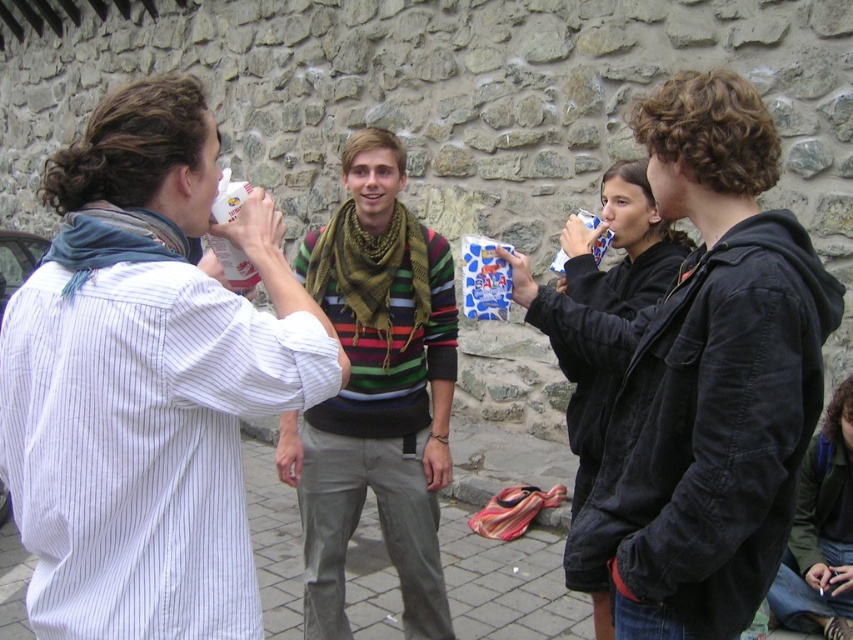
Between dark gray hoodie at right and white paper cup at upper left, which one appears on the right side from the viewer's perspective?

From the viewer's perspective, dark gray hoodie at right appears more on the right side.

Who is taller, dark gray hoodie at right or white paper cup at upper left?

dark gray hoodie at right is taller.

In order to click on dark gray hoodie at right in this screenshot , I will do `click(711, 380)`.

Can you confirm if white striped shirt at left is thinner than dark gray hoodie at right?

No, white striped shirt at left is not thinner than dark gray hoodie at right.

Which is in front, point (149, 148) or point (740, 371)?

Point (149, 148) is more forward.

This screenshot has height=640, width=853. Identify the location of white striped shirt at left. (148, 380).

Which is behind, point (149, 264) or point (811, 630)?

The point (811, 630) is behind.

Can you confirm if white striped shirt at left is thinner than dark green fabric jacket at lower right?

In fact, white striped shirt at left might be wider than dark green fabric jacket at lower right.

You are a GUI agent. You are given a task and a screenshot of the screen. Output one action in this format:
    pyautogui.click(x=<x>, y=<y>)
    Task: Click on the white striped shirt at left
    This screenshot has width=853, height=640.
    Given the screenshot: What is the action you would take?
    pyautogui.click(x=148, y=380)